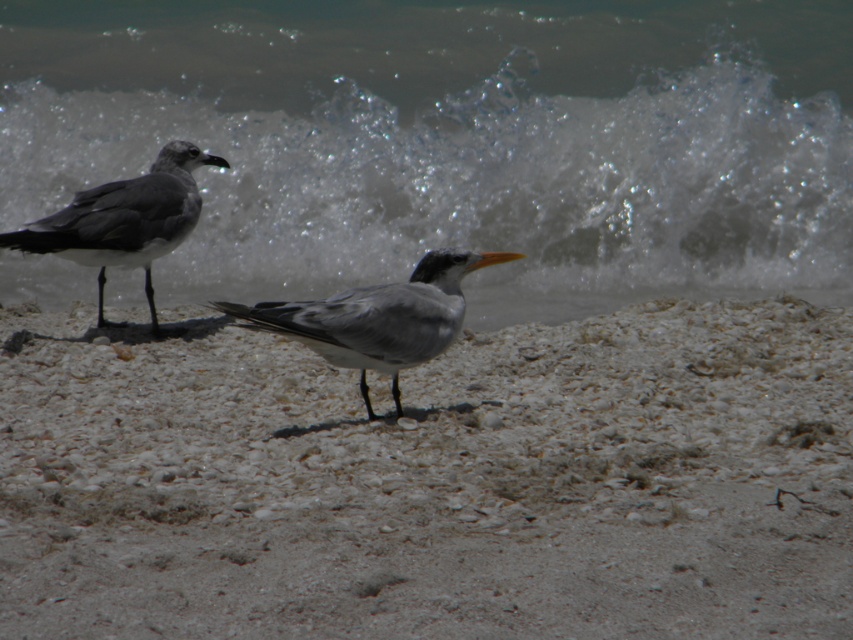
Question: Estimate the real-world distances between objects in this image. Which object is closer to the gray matte bird at center?

Choices:
 (A) white sandy beach at center
 (B) gray matte seagull at left

Answer: (A)

Question: Among these points, which one is farthest from the camera?

Choices:
 (A) (239, 28)
 (B) (215, 304)
 (C) (845, 579)
 (D) (161, 168)

Answer: (A)

Question: Is gray matte bird at center thinner than gray matte seagull at left?

Choices:
 (A) yes
 (B) no

Answer: (B)

Question: Is white sandy beach at center thinner than clear water at upper center?

Choices:
 (A) yes
 (B) no

Answer: (A)

Question: Which point is closer to the camera taking this photo?

Choices:
 (A) (614, 566)
 (B) (312, 45)

Answer: (A)

Question: Is white sandy beach at center above gray matte bird at center?

Choices:
 (A) no
 (B) yes

Answer: (A)